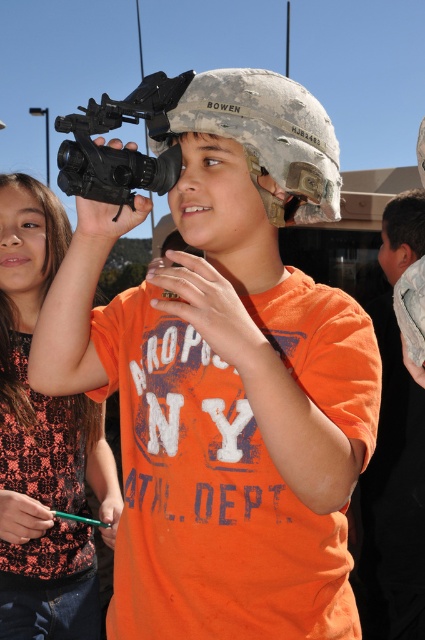
Who is taller, orange lace shirt at upper left or black matte gun at center?

orange lace shirt at upper left is taller.

Is orange lace shirt at upper left shorter than black matte gun at center?

Incorrect, orange lace shirt at upper left's height does not fall short of black matte gun at center's.

The height and width of the screenshot is (640, 425). Identify the location of orange lace shirt at upper left. (44, 440).